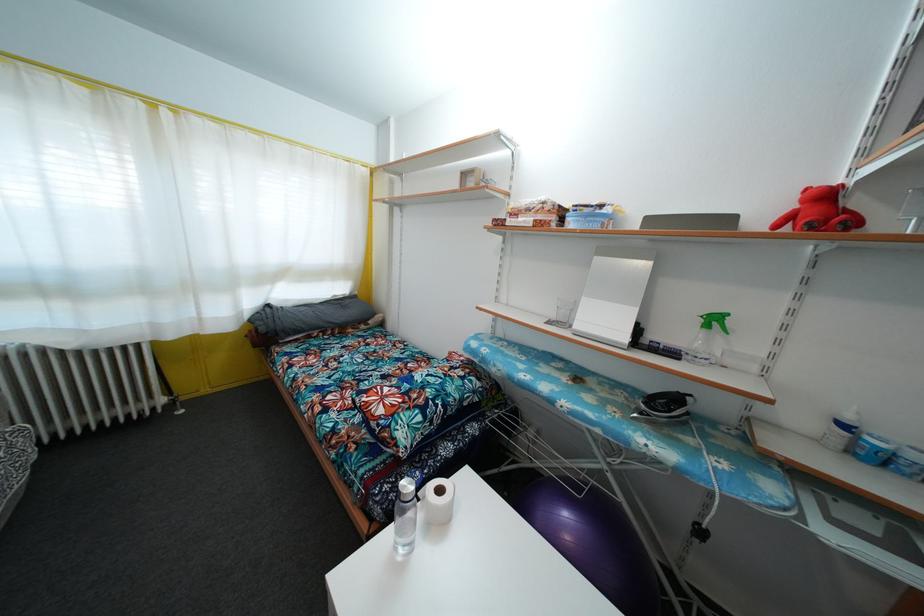
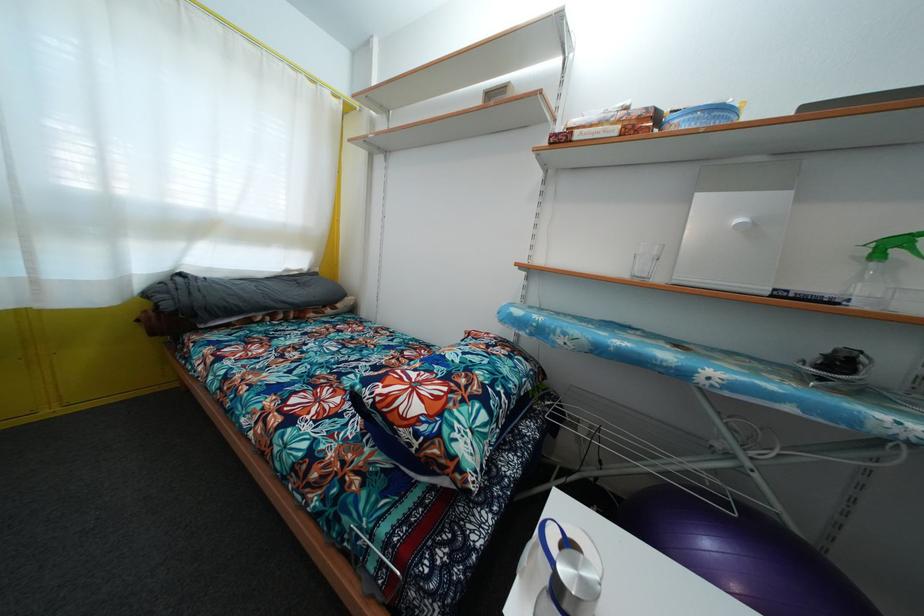
Question: The camera is either moving clockwise (left) or counter-clockwise (right) around the object. The first image is from the beginning of the video and the second image is from the end. Is the camera moving left or right when shooting the video?

Choices:
 (A) Left
 (B) Right

Answer: (A)